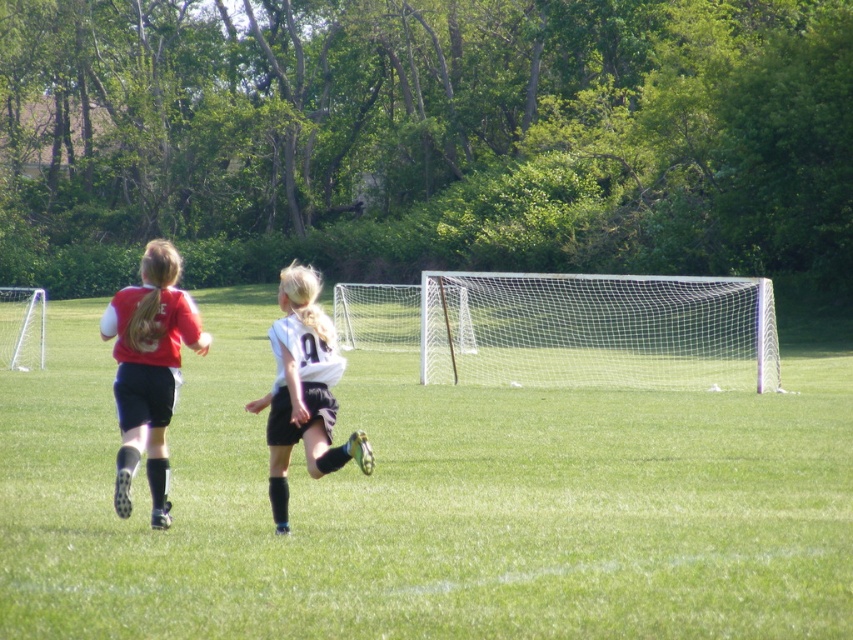
Question: Which point is farther from the camera taking this photo?

Choices:
 (A) (144, 340)
 (B) (622, 284)
 (C) (270, 410)
 (D) (637, 493)

Answer: (B)

Question: Based on their relative distances, which object is farther from the green grass field at center?

Choices:
 (A) white matte jersey at center
 (B) white mesh net at center

Answer: (A)

Question: Which point is farther to the camera?

Choices:
 (A) white mesh net at center
 (B) white matte jersey at center
 (C) matte red jersey at left

Answer: (A)

Question: Does green grass field at center have a smaller size compared to matte red jersey at left?

Choices:
 (A) no
 (B) yes

Answer: (B)

Question: Is white mesh net at center to the right of white matte jersey at center from the viewer's perspective?

Choices:
 (A) no
 (B) yes

Answer: (B)

Question: From the image, what is the correct spatial relationship of white mesh net at center in relation to matte red jersey at left?

Choices:
 (A) right
 (B) left

Answer: (A)